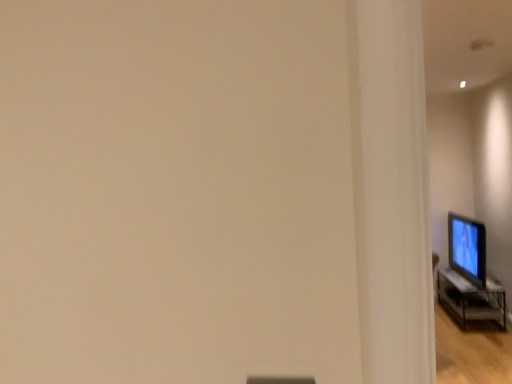
Describe the element at coordinates (467, 248) in the screenshot. This screenshot has height=384, width=512. I see `matte black tv at right` at that location.

Find the location of a particular element. This screenshot has width=512, height=384. matte black tv at right is located at coordinates (467, 248).

You are a GUI agent. You are given a task and a screenshot of the screen. Output one action in this format:
    pyautogui.click(x=<x>, y=<y>)
    Task: Click on the matte black tv at right
    Image resolution: width=512 pixels, height=384 pixels.
    Given the screenshot: What is the action you would take?
    pyautogui.click(x=467, y=248)